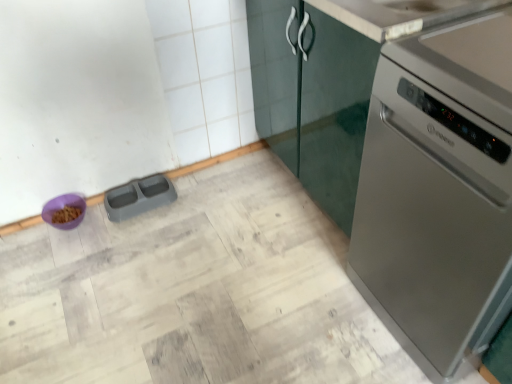
What is the approximate width of gray plastic pet feeder at lower left, which is the 1th appliance from right to left?

gray plastic pet feeder at lower left, which is the 1th appliance from right to left, is 5.96 inches in width.

What are the coordinates of `satin silver dishwasher at right` in the screenshot? It's located at (439, 193).

I want to click on gray plastic pet feeder at lower left, which is the 1th appliance from right to left, so click(138, 197).

From the image's perspective, who appears lower, satin silver dishwasher at right or gray plastic pet feeder at lower left, which is the 1th appliance from right to left?

satin silver dishwasher at right appears lower in the image.

Does satin silver dishwasher at right have a lesser height compared to gray plastic pet feeder at lower left, which is the 1th appliance from right to left?

In fact, satin silver dishwasher at right may be taller than gray plastic pet feeder at lower left, which is the 1th appliance from right to left.

From a real-world perspective, is satin silver dishwasher at right above or below gray plastic pet feeder at lower left, which is the 1th appliance from right to left?

From a real-world perspective, satin silver dishwasher at right is physically above gray plastic pet feeder at lower left, which is the 1th appliance from right to left.

Considering the positions of objects purple plastic bowl at lower left, arranged as the 1th appliance when viewed from the left, and gray plastic pet feeder at lower left, which is the 1th appliance from right to left, in the image provided, who is more to the left, purple plastic bowl at lower left, arranged as the 1th appliance when viewed from the left, or gray plastic pet feeder at lower left, which is the 1th appliance from right to left,?

From the viewer's perspective, purple plastic bowl at lower left, arranged as the 1th appliance when viewed from the left, appears more on the left side.

Are purple plastic bowl at lower left, arranged as the 1th appliance when viewed from the left, and gray plastic pet feeder at lower left, the 2th appliance in the left-to-right sequence, located far from each other?

purple plastic bowl at lower left, arranged as the 1th appliance when viewed from the left, is actually quite close to gray plastic pet feeder at lower left, the 2th appliance in the left-to-right sequence.

From a real-world perspective, is purple plastic bowl at lower left, the 2th appliance viewed from the right, located beneath gray plastic pet feeder at lower left, the 2th appliance in the left-to-right sequence?

No, from a real-world perspective, purple plastic bowl at lower left, the 2th appliance viewed from the right, is not below gray plastic pet feeder at lower left, the 2th appliance in the left-to-right sequence.

Based on the photo, between purple plastic bowl at lower left, the 2th appliance viewed from the right, and gray plastic pet feeder at lower left, which is the 1th appliance from right to left, which one is positioned behind?

gray plastic pet feeder at lower left, which is the 1th appliance from right to left, is more distant.

Between gray plastic pet feeder at lower left, which is the 1th appliance from right to left, and purple plastic bowl at lower left, the 2th appliance viewed from the right, which one has larger width?

gray plastic pet feeder at lower left, which is the 1th appliance from right to left.

Between gray plastic pet feeder at lower left, the 2th appliance in the left-to-right sequence, and purple plastic bowl at lower left, arranged as the 1th appliance when viewed from the left, which one has less height?

gray plastic pet feeder at lower left, the 2th appliance in the left-to-right sequence.

Based on the photo, from a real-world perspective, between gray plastic pet feeder at lower left, the 2th appliance in the left-to-right sequence, and purple plastic bowl at lower left, arranged as the 1th appliance when viewed from the left, who is vertically lower?

gray plastic pet feeder at lower left, the 2th appliance in the left-to-right sequence.

From a real-world perspective, does satin silver dishwasher at right stand above purple plastic bowl at lower left, arranged as the 1th appliance when viewed from the left?

A: Correct, in the physical world, satin silver dishwasher at right is higher than purple plastic bowl at lower left, arranged as the 1th appliance when viewed from the left.

Is satin silver dishwasher at right facing away from purple plastic bowl at lower left, the 2th appliance viewed from the right?

satin silver dishwasher at right does not have its back to purple plastic bowl at lower left, the 2th appliance viewed from the right.

Looking at this image, how distant is satin silver dishwasher at right from purple plastic bowl at lower left, arranged as the 1th appliance when viewed from the left?

A distance of 1.32 meters exists between satin silver dishwasher at right and purple plastic bowl at lower left, arranged as the 1th appliance when viewed from the left.

Is satin silver dishwasher at right thinner than purple plastic bowl at lower left, arranged as the 1th appliance when viewed from the left?

Incorrect, the width of satin silver dishwasher at right is not less than that of purple plastic bowl at lower left, arranged as the 1th appliance when viewed from the left.

Find the location of a particular element. home appliance above the purple plastic bowl at lower left, arranged as the 1th appliance when viewed from the left (from the image's perspective) is located at coordinates (439, 193).

Could you tell me if purple plastic bowl at lower left, arranged as the 1th appliance when viewed from the left, is turned towards satin silver dishwasher at right?

No.

How distant is purple plastic bowl at lower left, arranged as the 1th appliance when viewed from the left, from satin silver dishwasher at right?

They are 1.32 meters apart.

How many degrees apart are the facing directions of purple plastic bowl at lower left, arranged as the 1th appliance when viewed from the left, and satin silver dishwasher at right?

89.8 degrees separate the facing orientations of purple plastic bowl at lower left, arranged as the 1th appliance when viewed from the left, and satin silver dishwasher at right.

Is there a large distance between gray plastic pet feeder at lower left, the 2th appliance in the left-to-right sequence, and satin silver dishwasher at right?

gray plastic pet feeder at lower left, the 2th appliance in the left-to-right sequence, is positioned a significant distance from satin silver dishwasher at right.

Can we say gray plastic pet feeder at lower left, which is the 1th appliance from right to left, lies outside satin silver dishwasher at right?

gray plastic pet feeder at lower left, which is the 1th appliance from right to left, is positioned outside satin silver dishwasher at right.

Based on the photo, is gray plastic pet feeder at lower left, the 2th appliance in the left-to-right sequence, wider or thinner than satin silver dishwasher at right?

Clearly, gray plastic pet feeder at lower left, the 2th appliance in the left-to-right sequence, has less width compared to satin silver dishwasher at right.

In the image, there is a satin silver dishwasher at right. Where is `appliance above it (from the image's perspective)`? Image resolution: width=512 pixels, height=384 pixels. appliance above it (from the image's perspective) is located at coordinates (138, 197).

Identify the location of appliance above the satin silver dishwasher at right (from the image's perspective). This screenshot has height=384, width=512. (138, 197).

This screenshot has width=512, height=384. Identify the location of appliance that appears below the gray plastic pet feeder at lower left, the 2th appliance in the left-to-right sequence (from the image's perspective). (62, 207).

In the scene shown: Considering their positions, is satin silver dishwasher at right positioned further to purple plastic bowl at lower left, arranged as the 1th appliance when viewed from the left, than gray plastic pet feeder at lower left, the 2th appliance in the left-to-right sequence?

satin silver dishwasher at right is positioned further to the anchor purple plastic bowl at lower left, arranged as the 1th appliance when viewed from the left.

When comparing their distances from purple plastic bowl at lower left, the 2th appliance viewed from the right, does gray plastic pet feeder at lower left, the 2th appliance in the left-to-right sequence, or satin silver dishwasher at right seem further?

satin silver dishwasher at right is further to purple plastic bowl at lower left, the 2th appliance viewed from the right.

Based on their spatial positions, is satin silver dishwasher at right or purple plastic bowl at lower left, arranged as the 1th appliance when viewed from the left, closer to gray plastic pet feeder at lower left, which is the 1th appliance from right to left?

purple plastic bowl at lower left, arranged as the 1th appliance when viewed from the left, is closer to gray plastic pet feeder at lower left, which is the 1th appliance from right to left.

Estimate the real-world distances between objects in this image. Which object is closer to satin silver dishwasher at right, purple plastic bowl at lower left, arranged as the 1th appliance when viewed from the left, or gray plastic pet feeder at lower left, which is the 1th appliance from right to left?

gray plastic pet feeder at lower left, which is the 1th appliance from right to left, lies closer to satin silver dishwasher at right than the other object.

Looking at the image, which one is located further to satin silver dishwasher at right, gray plastic pet feeder at lower left, the 2th appliance in the left-to-right sequence, or purple plastic bowl at lower left, the 2th appliance viewed from the right?

purple plastic bowl at lower left, the 2th appliance viewed from the right.

Estimate the real-world distances between objects in this image. Which object is closer to gray plastic pet feeder at lower left, the 2th appliance in the left-to-right sequence, purple plastic bowl at lower left, the 2th appliance viewed from the right, or satin silver dishwasher at right?

Among the two, purple plastic bowl at lower left, the 2th appliance viewed from the right, is located nearer to gray plastic pet feeder at lower left, the 2th appliance in the left-to-right sequence.

Find the location of a particular element. The width and height of the screenshot is (512, 384). appliance between purple plastic bowl at lower left, arranged as the 1th appliance when viewed from the left, and satin silver dishwasher at right from left to right is located at coordinates (138, 197).